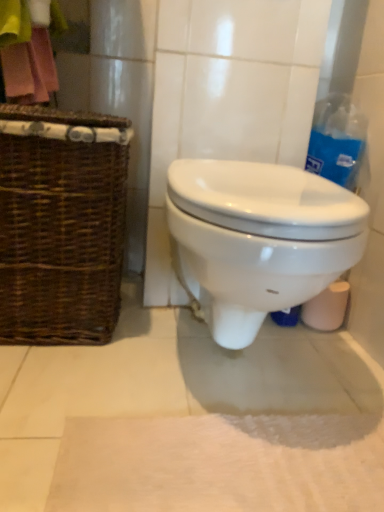
Describe the element at coordinates (25, 55) in the screenshot. The image size is (384, 512). I see `pink fabric at upper left` at that location.

Describe the element at coordinates (61, 224) in the screenshot. I see `brown woven picnic basket at left` at that location.

What is the approximate height of blue plastic bag at upper right?

blue plastic bag at upper right is 15.38 centimeters tall.

This screenshot has width=384, height=512. I want to click on blue plastic bag at upper right, so click(x=338, y=141).

Find the location of a particular element. The height and width of the screenshot is (512, 384). pink fabric at upper left is located at coordinates (25, 55).

Would you say blue plastic bag at upper right is to the left or to the right of white glossy toilet at center in the picture?

Based on their positions, blue plastic bag at upper right is located to the right of white glossy toilet at center.

Are blue plastic bag at upper right and white glossy toilet at center located far from each other?

That's not correct — blue plastic bag at upper right is a little close to white glossy toilet at center.

Are white glossy toilet at center and blue plastic bag at upper right far apart?

white glossy toilet at center is near blue plastic bag at upper right, not far away.

In order to click on toilet below the blue plastic bag at upper right (from the image's perspective) in this screenshot , I will do `click(258, 239)`.

From the image's perspective, who appears lower, white glossy toilet at center or blue plastic bag at upper right?

white glossy toilet at center appears lower in the image.

Which object is positioned more to the left, white soft bath mat at lower center or brown woven picnic basket at left?

From the viewer's perspective, brown woven picnic basket at left appears more on the left side.

Looking at this image, considering the positions of objects white soft bath mat at lower center and brown woven picnic basket at left in the image provided, who is behind, white soft bath mat at lower center or brown woven picnic basket at left?

brown woven picnic basket at left is more distant.

From the picture: Considering the sizes of objects white soft bath mat at lower center and brown woven picnic basket at left in the image provided, who is shorter, white soft bath mat at lower center or brown woven picnic basket at left?

With less height is white soft bath mat at lower center.

Looking at the image, does white glossy toilet at center seem bigger or smaller compared to brown woven picnic basket at left?

Clearly, white glossy toilet at center is larger in size than brown woven picnic basket at left.

Does white glossy toilet at center turn towards brown woven picnic basket at left?

No, white glossy toilet at center is not aimed at brown woven picnic basket at left.

Where is `picnic basket above the white glossy toilet at center (from a real-world perspective)`? This screenshot has height=512, width=384. picnic basket above the white glossy toilet at center (from a real-world perspective) is located at coordinates (61, 224).

From a real-world perspective, relative to brown woven picnic basket at left, is white glossy toilet at center vertically above or below?

white glossy toilet at center is situated lower than brown woven picnic basket at left in the real world.

Considering the relative sizes of brown woven picnic basket at left and pink fabric at upper left in the image provided, is brown woven picnic basket at left taller than pink fabric at upper left?

Correct, brown woven picnic basket at left is much taller as pink fabric at upper left.

From the picture: Choose the correct answer: Is brown woven picnic basket at left inside pink fabric at upper left or outside it?

brown woven picnic basket at left is located beyond the bounds of pink fabric at upper left.

Between brown woven picnic basket at left and pink fabric at upper left, which one appears on the left side from the viewer's perspective?

pink fabric at upper left.

Is white glossy toilet at center facing towards pink fabric at upper left?

No, white glossy toilet at center is not turned towards pink fabric at upper left.

Between white glossy toilet at center and pink fabric at upper left, which one has smaller width?

With smaller width is pink fabric at upper left.

Are white glossy toilet at center and pink fabric at upper left far apart?

No.

Consider the image. Which is more to the right, brown woven picnic basket at left or blue plastic bag at upper right?

blue plastic bag at upper right.

Which is further, (49, 184) or (337, 162)?

Point (337, 162)

From a real-world perspective, is brown woven picnic basket at left beneath blue plastic bag at upper right?

Yes, from a real-world perspective, brown woven picnic basket at left is beneath blue plastic bag at upper right.

Between brown woven picnic basket at left and blue plastic bag at upper right, which one has larger width?

brown woven picnic basket at left.

Find the location of a particular element. This screenshot has width=384, height=512. cleaning product behind the white glossy toilet at center is located at coordinates (338, 141).

In the image, there is a blue plastic bag at upper right. At what (x,y) coordinates should I click in order to perform the action: click on toilet below it (from the image's perspective). Please return your answer as a coordinate pair (x, y). Looking at the image, I should click on (258, 239).

Based on their spatial positions, is blue plastic bag at upper right or brown woven picnic basket at left further from white soft bath mat at lower center?

Among the two, blue plastic bag at upper right is located further to white soft bath mat at lower center.

Looking at the image, which one is located further to white glossy toilet at center, white soft bath mat at lower center or blue plastic bag at upper right?

Based on the image, blue plastic bag at upper right appears to be further to white glossy toilet at center.

Considering their positions, is brown woven picnic basket at left positioned further to pink fabric at upper left than blue plastic bag at upper right?

blue plastic bag at upper right is positioned further to the anchor pink fabric at upper left.

Considering their positions, is brown woven picnic basket at left positioned further to blue plastic bag at upper right than pink fabric at upper left?

pink fabric at upper left is further to blue plastic bag at upper right.

Which object lies further to the anchor point brown woven picnic basket at left, pink fabric at upper left or blue plastic bag at upper right?

blue plastic bag at upper right is positioned further to the anchor brown woven picnic basket at left.

Considering their positions, is brown woven picnic basket at left positioned further to white soft bath mat at lower center than white glossy toilet at center?

brown woven picnic basket at left.

Considering their positions, is brown woven picnic basket at left positioned further to white glossy toilet at center than pink fabric at upper left?

pink fabric at upper left is positioned further to the anchor white glossy toilet at center.

Looking at the image, which one is located closer to white glossy toilet at center, white soft bath mat at lower center or brown woven picnic basket at left?

Based on the image, brown woven picnic basket at left appears to be nearer to white glossy toilet at center.

This screenshot has width=384, height=512. Identify the location of toilet located between pink fabric at upper left and blue plastic bag at upper right in the left-right direction. (258, 239).

Locate an element on the screen. toilet between white soft bath mat at lower center and blue plastic bag at upper right from front to back is located at coordinates (258, 239).

This screenshot has height=512, width=384. Identify the location of toilet located between brown woven picnic basket at left and blue plastic bag at upper right in the left-right direction. (258, 239).

At what (x,y) coordinates should I click in order to perform the action: click on picnic basket between pink fabric at upper left and blue plastic bag at upper right in the horizontal direction. Please return your answer as a coordinate pair (x, y). Image resolution: width=384 pixels, height=512 pixels. Looking at the image, I should click on pos(61,224).